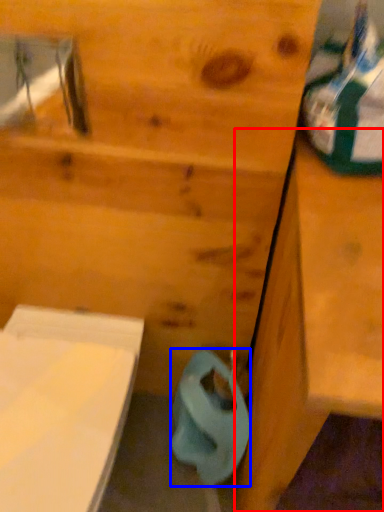
Question: Which object appears farthest to the camera in this image, vanity (highlighted by a red box) or toilet paper (highlighted by a blue box)?

Choices:
 (A) vanity
 (B) toilet paper

Answer: (B)